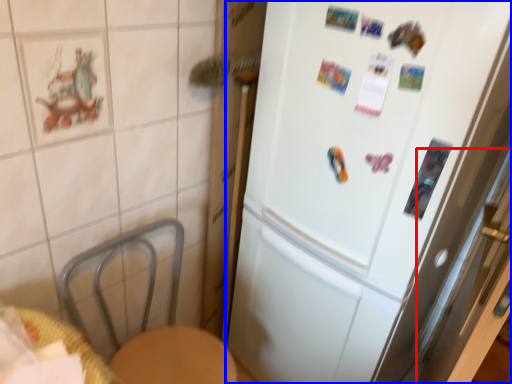
Question: Which object appears farthest to the camera in this image, screen door (highlighted by a red box) or refrigerator (highlighted by a blue box)?

Choices:
 (A) screen door
 (B) refrigerator

Answer: (B)